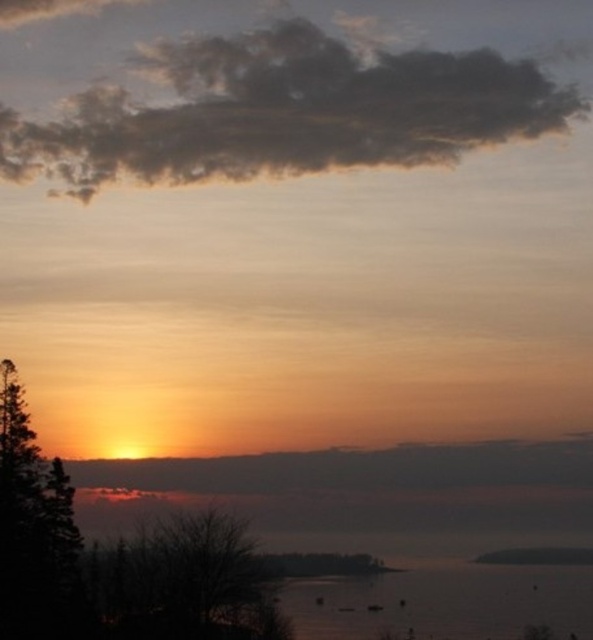
Consider the image. Which of these two, silvery reflective water at lower center or dark green leafy tree at left, stands shorter?

silvery reflective water at lower center

Does silvery reflective water at lower center have a larger size compared to dark green leafy tree at left?

Yes.

Between point (486, 593) and point (24, 410), which one is positioned in front?

Point (24, 410)

Image resolution: width=593 pixels, height=640 pixels. I want to click on silvery reflective water at lower center, so (x=428, y=596).

From the picture: Can you confirm if dark gray fluffy cloud at upper center is positioned to the left of silvery reflective water at lower center?

Correct, you'll find dark gray fluffy cloud at upper center to the left of silvery reflective water at lower center.

Is dark gray fluffy cloud at upper center above silvery reflective water at lower center?

Correct, dark gray fluffy cloud at upper center is located above silvery reflective water at lower center.

Where is `dark gray fluffy cloud at upper center`? dark gray fluffy cloud at upper center is located at coordinates (285, 109).

Looking at this image, can you confirm if dark gray fluffy cloud at upper center is wider than dark green leafy tree at left?

Yes.

Where is `dark gray fluffy cloud at upper center`? Image resolution: width=593 pixels, height=640 pixels. dark gray fluffy cloud at upper center is located at coordinates (285, 109).